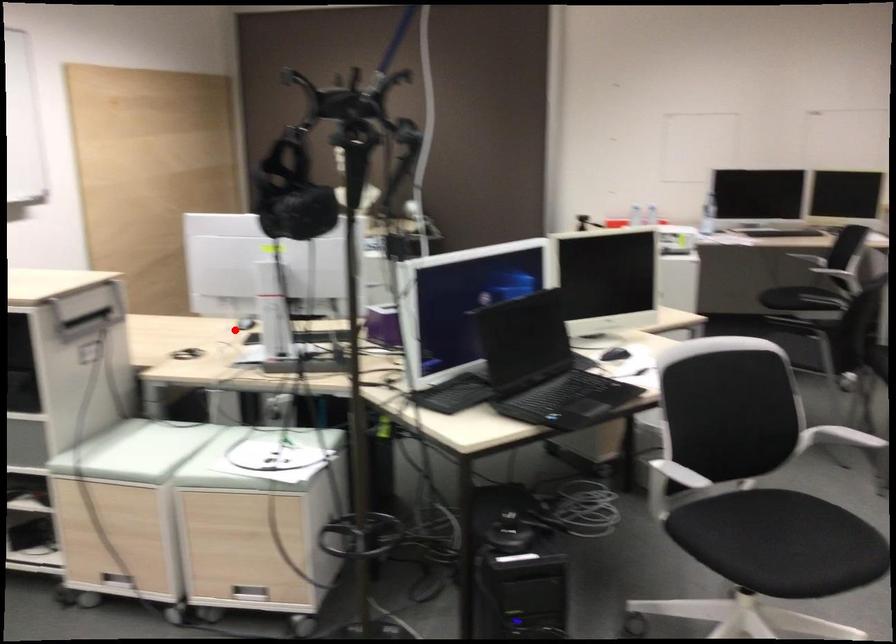
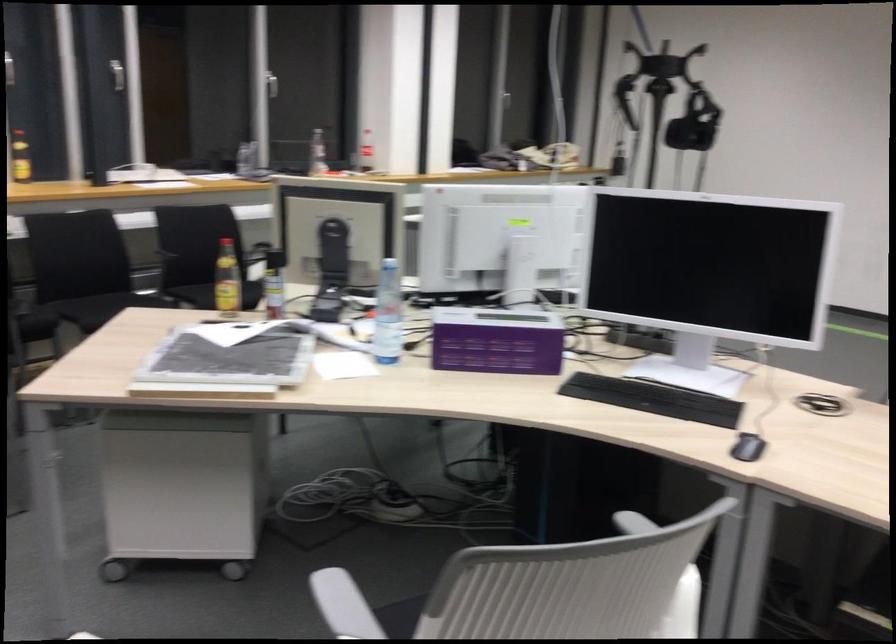
Question: I am providing you with two images of the same scene from different viewpoints. A red point is shown in image1. For the corresponding object point in image2, is it positioned nearer or farther from the camera?

Choices:
 (A) Nearer
 (B) Farther

Answer: (A)